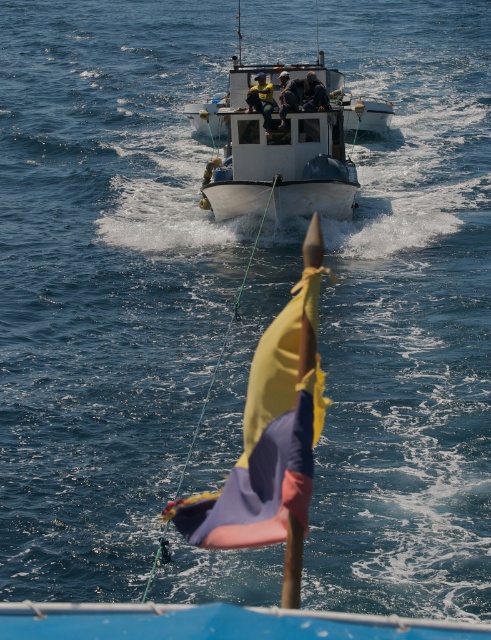
Question: Is yellow fabric jacket at center thinner than dark blue fabric jacket at center?

Choices:
 (A) yes
 (B) no

Answer: (B)

Question: Is the position of yellow fabric flag at center less distant than that of yellow fabric jacket at center?

Choices:
 (A) yes
 (B) no

Answer: (A)

Question: Which of the following is the farthest from the observer?

Choices:
 (A) (209, 541)
 (B) (319, 100)
 (C) (298, 138)
 (D) (247, 109)

Answer: (D)

Question: Which of these objects is positioned closest to the yellow fabric jacket at center?

Choices:
 (A) dark blue fabric jacket at center
 (B) yellow fabric flag at center

Answer: (A)

Question: Which point is closer to the camera?

Choices:
 (A) dark blue fabric jacket at center
 (B) yellow fabric flag at center
 (C) white matte boat at center
 (D) yellow fabric jacket at center

Answer: (B)

Question: Is yellow fabric flag at center to the right of yellow fabric jacket at center from the viewer's perspective?

Choices:
 (A) no
 (B) yes

Answer: (B)